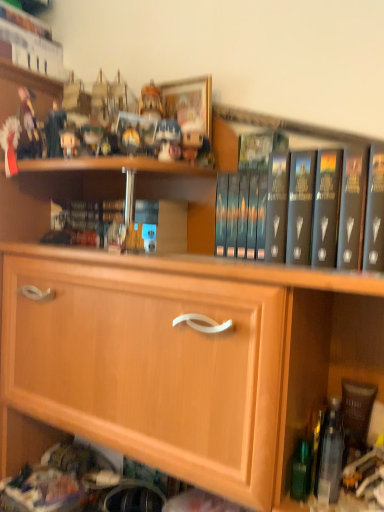
Question: Is the depth of dark gray hardcover book at center, the 3th book in the left-to-right sequence, greater than that of matte plastic figurine at upper left, acting as the 1th toy starting from the back?

Choices:
 (A) yes
 (B) no

Answer: (B)

Question: Is dark gray hardcover book at center, the second book from the top, shorter than matte plastic figurine at upper left, marked as the second toy in a right-to-left arrangement?

Choices:
 (A) yes
 (B) no

Answer: (B)

Question: From the image's perspective, is dark gray hardcover book at center, the second book from the top, beneath matte plastic figurine at upper left, which ranks as the second toy in front-to-back order?

Choices:
 (A) no
 (B) yes

Answer: (B)

Question: From a real-world perspective, is dark gray hardcover book at center, the 1th book when ordered from front to back, positioned over matte plastic figurine at upper left, placed as the first toy when sorted from left to right, based on gravity?

Choices:
 (A) no
 (B) yes

Answer: (A)

Question: Does dark gray hardcover book at center, which ranks as the first book in right-to-left order, have a smaller size compared to matte plastic figurine at upper left, marked as the second toy in a right-to-left arrangement?

Choices:
 (A) yes
 (B) no

Answer: (B)

Question: Is matte plastic figurine at upper left, which ranks as the second toy in front-to-back order, surrounded by dark gray hardcover book at center, which ranks as the first book in right-to-left order?

Choices:
 (A) no
 (B) yes

Answer: (A)

Question: Is dark gray hardcover book at center, which ranks as the first book in right-to-left order, far away from clear plastic bottle at lower right?

Choices:
 (A) no
 (B) yes

Answer: (A)

Question: Can you confirm if dark gray hardcover book at center, the 3th book in the left-to-right sequence, is taller than clear plastic bottle at lower right?

Choices:
 (A) no
 (B) yes

Answer: (B)

Question: From a real-world perspective, is dark gray hardcover book at center, the second book from the top, positioned over clear plastic bottle at lower right based on gravity?

Choices:
 (A) no
 (B) yes

Answer: (B)

Question: Would you say dark gray hardcover book at center, the second book when ordered from bottom to top, contains clear plastic bottle at lower right?

Choices:
 (A) yes
 (B) no

Answer: (B)

Question: Considering the relative sizes of dark gray hardcover book at center, the second book when ordered from bottom to top, and clear plastic bottle at lower right in the image provided, is dark gray hardcover book at center, the second book when ordered from bottom to top, thinner than clear plastic bottle at lower right?

Choices:
 (A) yes
 (B) no

Answer: (B)

Question: Is dark gray hardcover book at center, the second book from the top, outside clear plastic bottle at lower right?

Choices:
 (A) yes
 (B) no

Answer: (A)

Question: Considering the relative sizes of clear plastic bottle at lower right and matte plastic toy at upper center, positioned as the 1th toy in front-to-back order, in the image provided, is clear plastic bottle at lower right wider than matte plastic toy at upper center, positioned as the 1th toy in front-to-back order,?

Choices:
 (A) no
 (B) yes

Answer: (B)